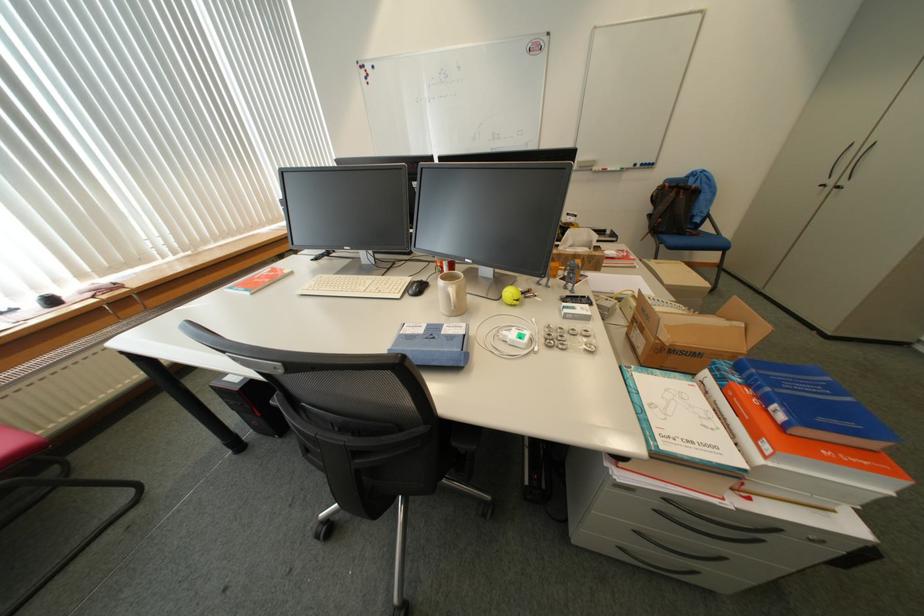
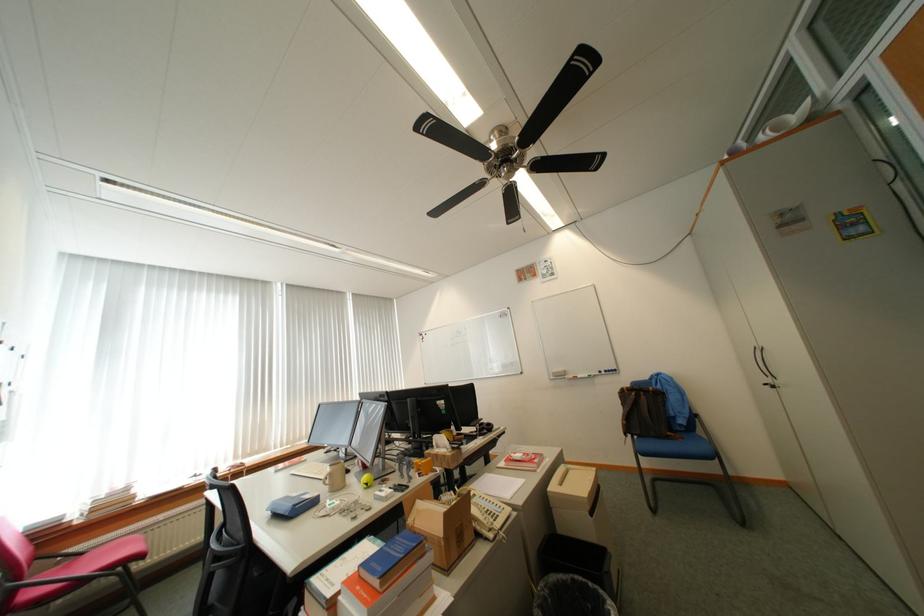
Where in the second image is the point corresponding to pixel 831 419 from the first image?

(383, 565)